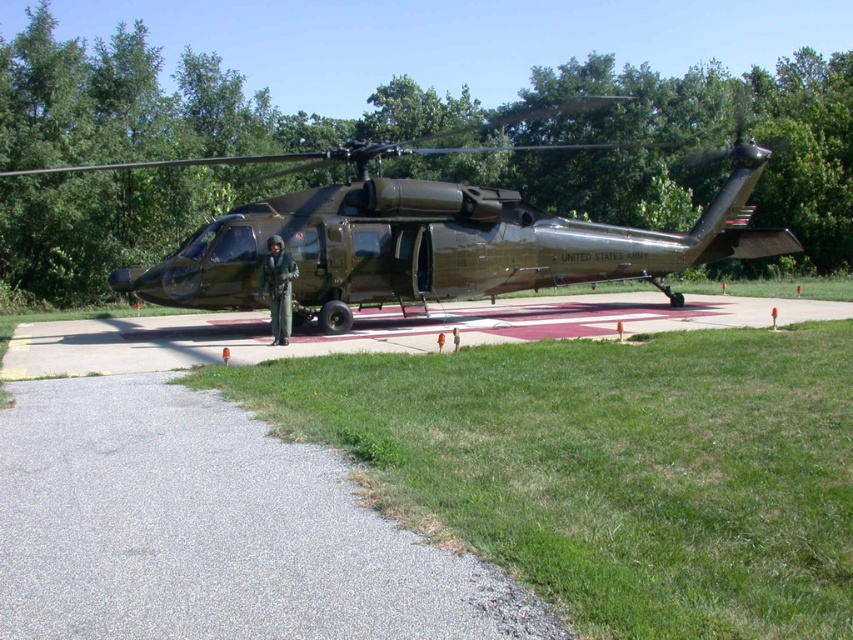
Question: Can you confirm if matte black helicopter at center is positioned to the left of concrete tarmac at center?

Choices:
 (A) no
 (B) yes

Answer: (A)

Question: Which object is positioned closest to the camouflage fabric uniform at center?

Choices:
 (A) matte black helicopter at center
 (B) gray asphalt tarmac at lower left

Answer: (A)

Question: Does matte black helicopter at center appear over concrete tarmac at center?

Choices:
 (A) yes
 (B) no

Answer: (A)

Question: Which is nearer to the camouflage fabric uniform at center?

Choices:
 (A) matte black helicopter at center
 (B) gray asphalt tarmac at lower left

Answer: (A)

Question: Does gray asphalt tarmac at lower left appear over camouflage fabric uniform at center?

Choices:
 (A) yes
 (B) no

Answer: (B)

Question: Estimate the real-world distances between objects in this image. Which object is farther from the concrete tarmac at center?

Choices:
 (A) gray asphalt tarmac at lower left
 (B) camouflage fabric uniform at center

Answer: (A)